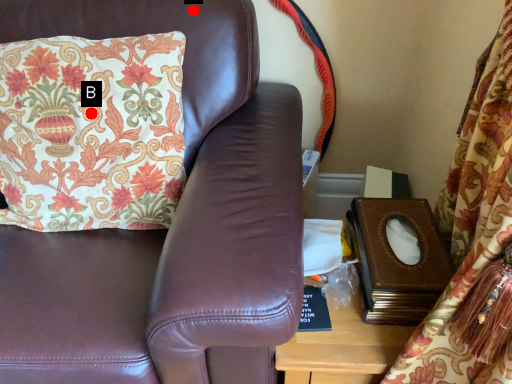
Question: Two points are circled on the image, labeled by A and B beside each circle. Which of the following is the closest to the observer?

Choices:
 (A) A is closer
 (B) B is closer

Answer: (B)